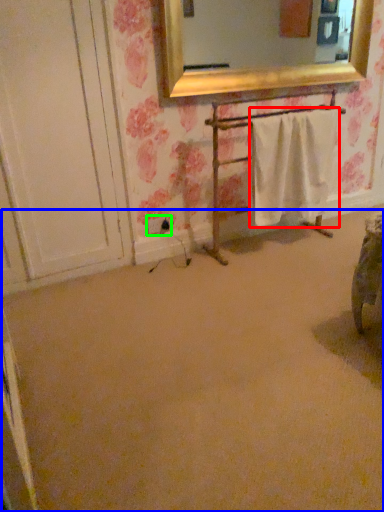
Question: Which is farther away from bath towel (highlighted by a red box)? plain (highlighted by a blue box) or electric outlet (highlighted by a green box)?

Choices:
 (A) plain
 (B) electric outlet

Answer: (A)